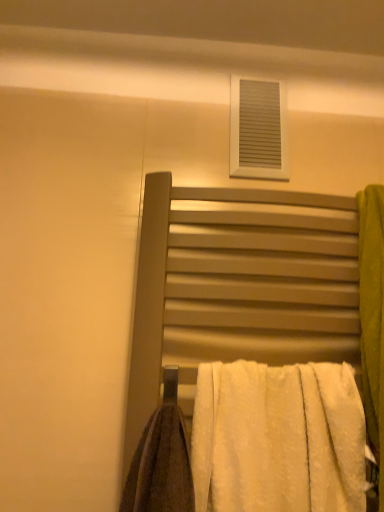
Question: Can you confirm if white matte vent at upper center is positioned to the right of white fluffy towel at center?

Choices:
 (A) no
 (B) yes

Answer: (B)

Question: Is white matte vent at upper center further to the viewer compared to white fluffy towel at center?

Choices:
 (A) yes
 (B) no

Answer: (A)

Question: Is white matte vent at upper center taller than white fluffy towel at center?

Choices:
 (A) no
 (B) yes

Answer: (A)

Question: Is white matte vent at upper center oriented away from white fluffy towel at center?

Choices:
 (A) yes
 (B) no

Answer: (B)

Question: Considering the relative sizes of white matte vent at upper center and white fluffy towel at center in the image provided, is white matte vent at upper center wider than white fluffy towel at center?

Choices:
 (A) no
 (B) yes

Answer: (A)

Question: Are white matte vent at upper center and white fluffy towel at center far apart?

Choices:
 (A) no
 (B) yes

Answer: (A)

Question: Is matte metal towel rack at center far away from white fluffy towel at center?

Choices:
 (A) yes
 (B) no

Answer: (B)

Question: From a real-world perspective, is matte metal towel rack at center positioned over white fluffy towel at center based on gravity?

Choices:
 (A) yes
 (B) no

Answer: (A)

Question: From the image's perspective, is matte metal towel rack at center over white fluffy towel at center?

Choices:
 (A) yes
 (B) no

Answer: (A)

Question: Is matte metal towel rack at center aimed at white fluffy towel at center?

Choices:
 (A) yes
 (B) no

Answer: (A)

Question: From the image's perspective, is matte metal towel rack at center below white fluffy towel at center?

Choices:
 (A) yes
 (B) no

Answer: (B)

Question: Is matte metal towel rack at center closer to camera compared to white fluffy towel at center?

Choices:
 (A) yes
 (B) no

Answer: (B)

Question: Is the depth of white fluffy towel at center greater than that of white matte vent at upper center?

Choices:
 (A) no
 (B) yes

Answer: (A)